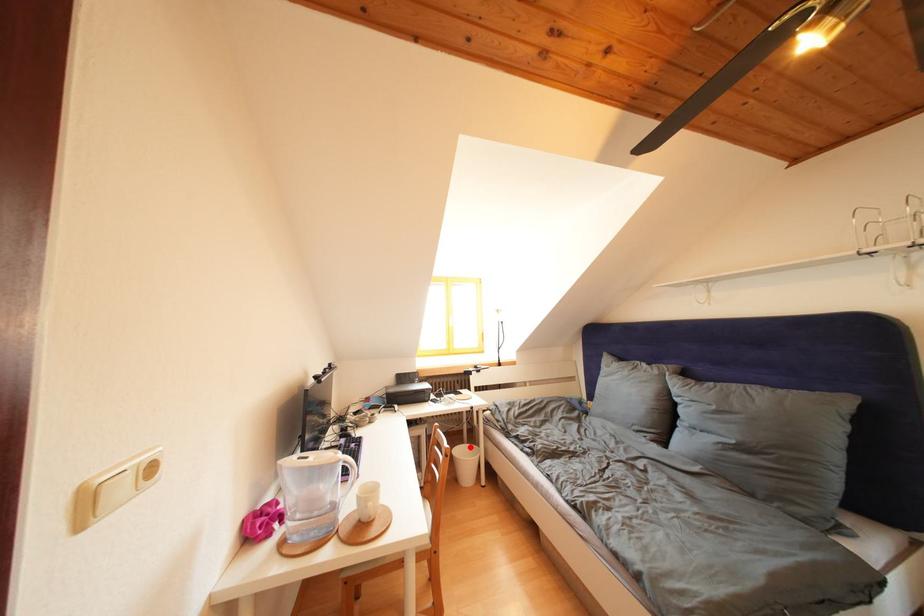
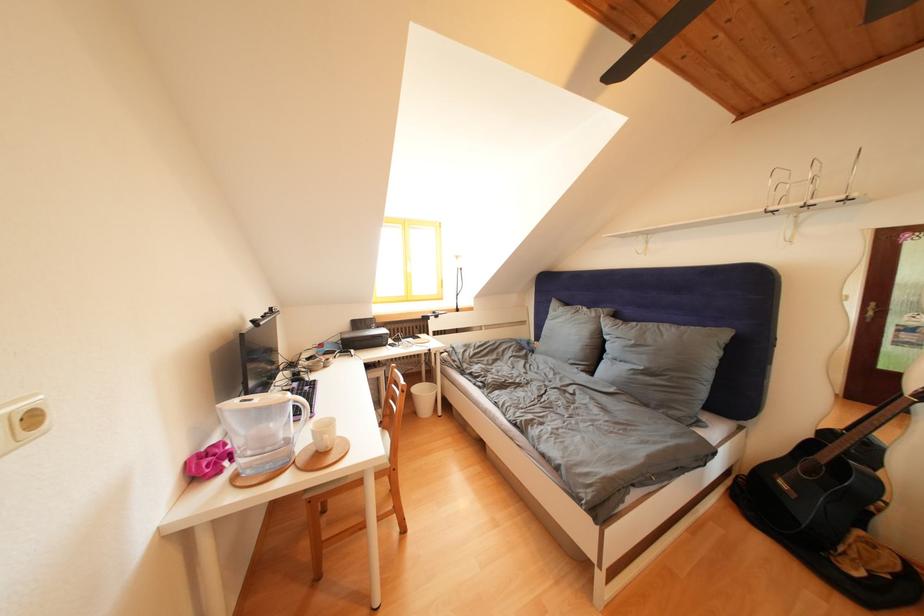
Find the pixel in the second image that matches the highlighted location in the first image.

(429, 387)